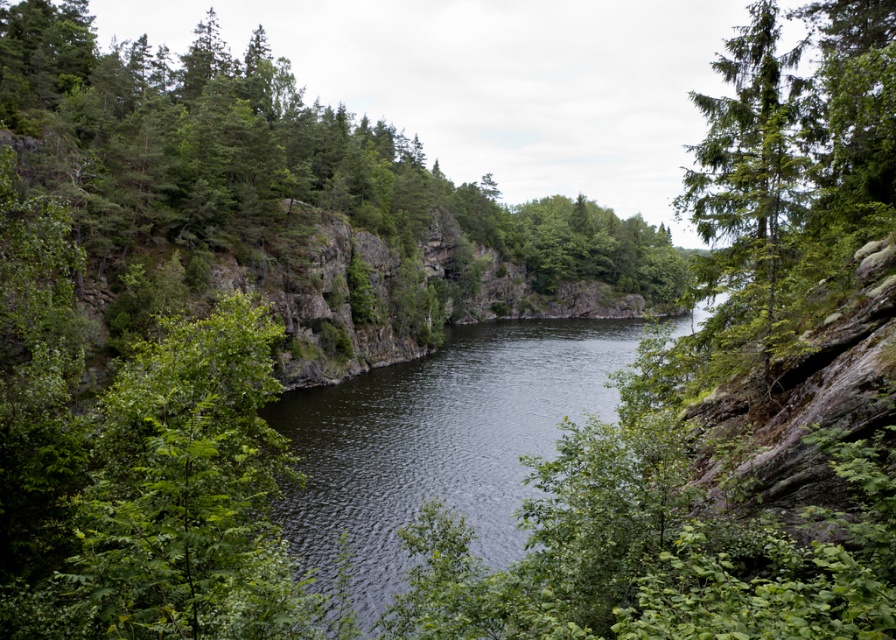
Which is above, dark water at center or green matte tree at upper right?

Positioned higher is green matte tree at upper right.

Does dark water at center appear over green matte tree at upper right?

Incorrect, dark water at center is not positioned above green matte tree at upper right.

Which is behind, point (517, 492) or point (700, 189)?

Positioned behind is point (517, 492).

I want to click on dark water at center, so click(x=438, y=444).